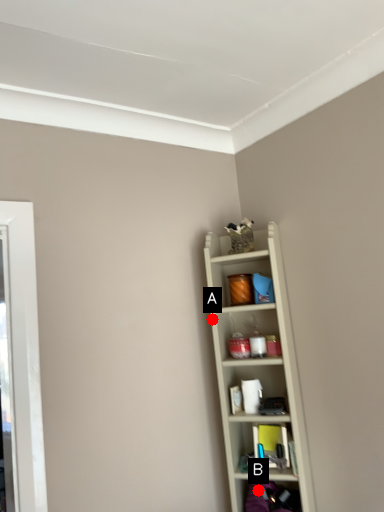
Question: Two points are circled on the image, labeled by A and B beside each circle. Which point appears farthest from the camera in this image?

Choices:
 (A) A is further
 (B) B is further

Answer: (A)